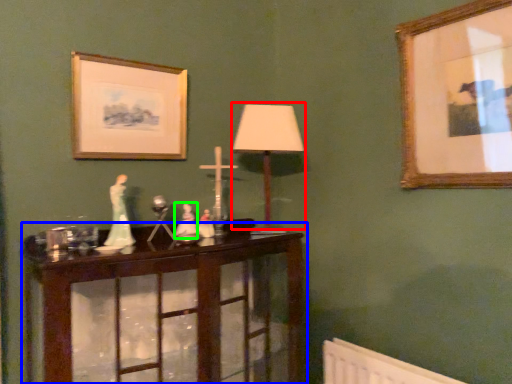
Question: Which object is positioned closest to table lamp (highlighted by a red box)? Select from table (highlighted by a blue box) and toy (highlighted by a green box).

Choices:
 (A) table
 (B) toy

Answer: (B)